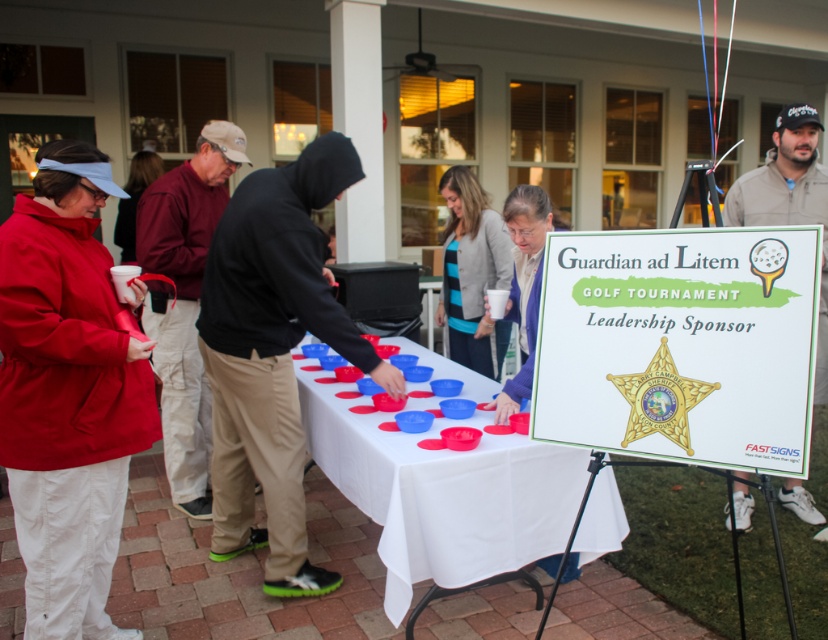
Question: Can you confirm if white cloth table at center is bigger than maroon fabric jacket at center?

Choices:
 (A) yes
 (B) no

Answer: (A)

Question: Does white cloth table at center appear over maroon fabric jacket at center?

Choices:
 (A) no
 (B) yes

Answer: (A)

Question: Does red nylon jacket at left have a lesser width compared to maroon fabric jacket at center?

Choices:
 (A) no
 (B) yes

Answer: (B)

Question: Estimate the real-world distances between objects in this image. Which object is farther from the maroon fabric jacket at center?

Choices:
 (A) white cloth table at center
 (B) red nylon jacket at left
 (C) khaki pants at center

Answer: (C)

Question: Which object is farther from the camera taking this photo?

Choices:
 (A) red nylon jacket at left
 (B) khaki pants at center

Answer: (B)

Question: Among these points, which one is farthest from the camera?

Choices:
 (A) pos(195,241)
 (B) pos(474,461)

Answer: (A)